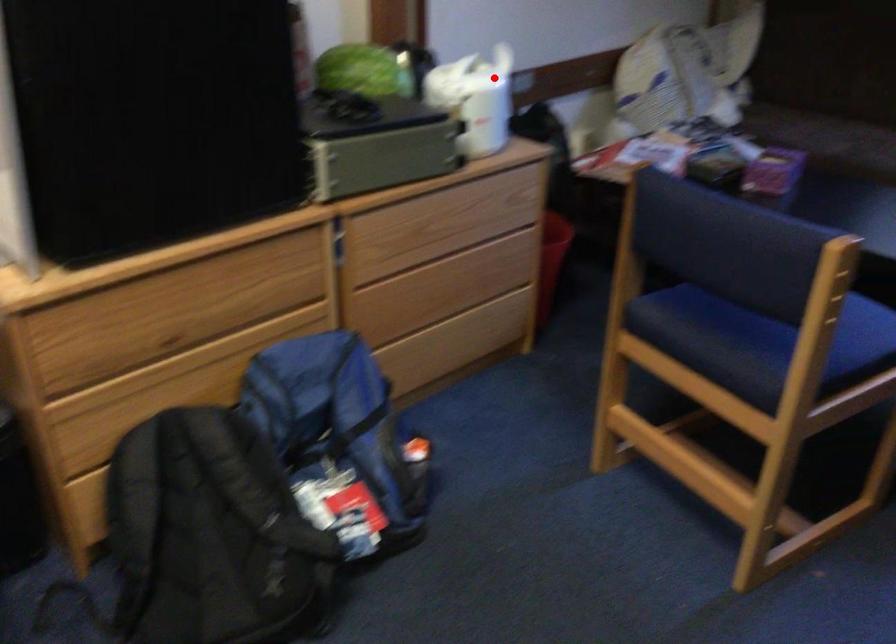
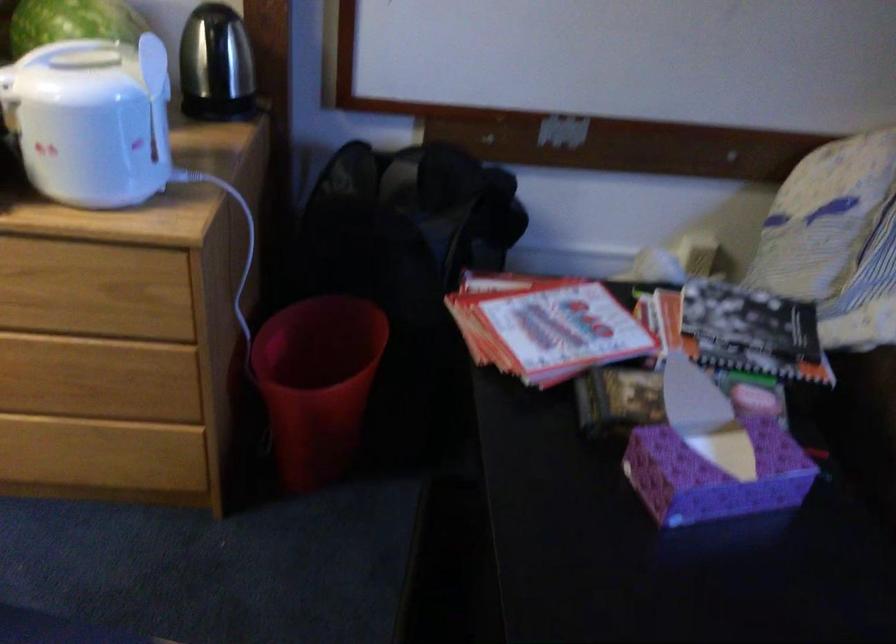
Question: I am providing you with two images of the same scene from different viewpoints. Given a red point in image1, look at the same physical point in image2. Is it:

Choices:
 (A) Closer to the viewpoint
 (B) Farther from the viewpoint

Answer: (A)